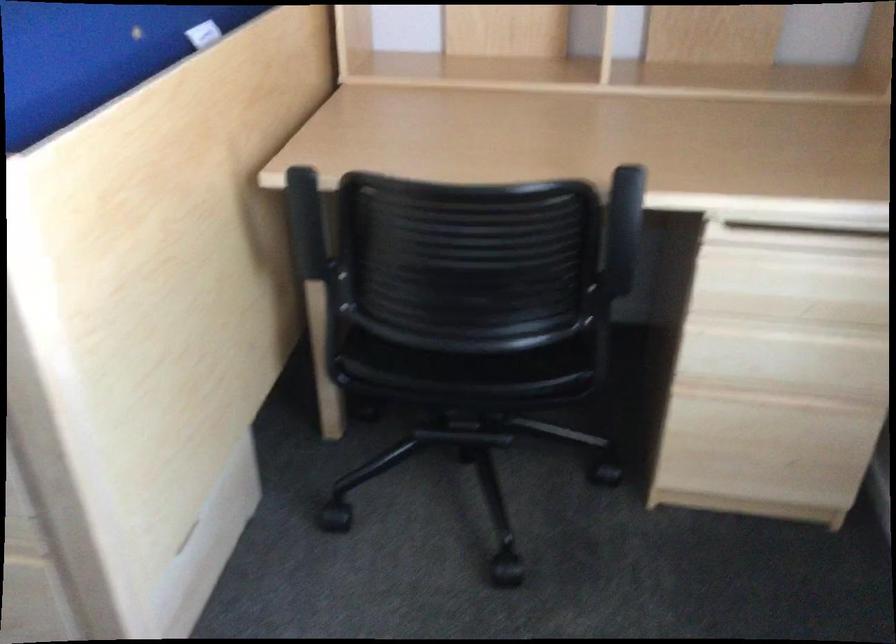
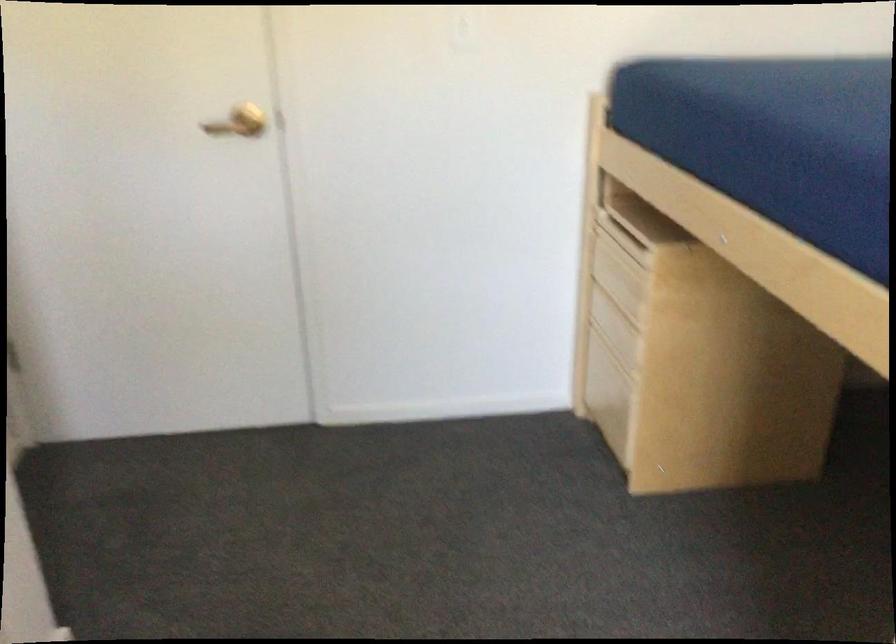
Question: The camera is either moving clockwise (left) or counter-clockwise (right) around the object. The first image is from the beginning of the video and the second image is from the end. Is the camera moving left or right when shooting the video?

Choices:
 (A) Left
 (B) Right

Answer: (B)